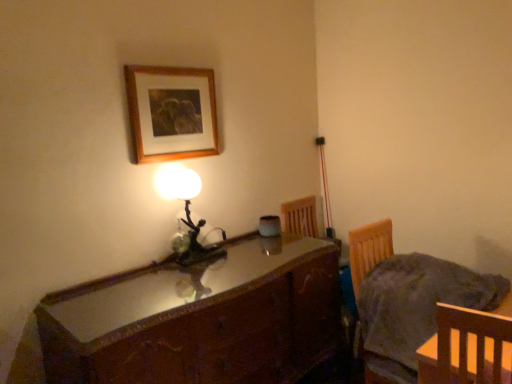
Locate an element on the screen. Image resolution: width=512 pixels, height=384 pixels. wooden picture frame at upper center is located at coordinates click(170, 112).

The image size is (512, 384). I want to click on shiny brown wooden desk at center, so (x=200, y=319).

How distant is matte glass lamp at center from wooden chair at lower right?

They are 32.79 inches apart.

Visually, is matte glass lamp at center positioned to the left or to the right of wooden chair at lower right?

In the image, matte glass lamp at center appears on the left side of wooden chair at lower right.

What's the angular difference between matte glass lamp at center and wooden chair at lower right's facing directions?

7.04 degrees.

From the picture: Is matte glass lamp at center wider or thinner than wooden chair at lower right?

In the image, matte glass lamp at center appears to be more narrow than wooden chair at lower right.

Does wooden chair at lower right come in front of shiny brown wooden desk at center?

No, wooden chair at lower right is behind shiny brown wooden desk at center.

Would you consider wooden chair at lower right to be distant from shiny brown wooden desk at center?

No, wooden chair at lower right is not far from shiny brown wooden desk at center.

Considering the positions of objects wooden chair at lower right and shiny brown wooden desk at center in the image provided, who is more to the left, wooden chair at lower right or shiny brown wooden desk at center?

shiny brown wooden desk at center.

Is wooden chair at lower right taller than shiny brown wooden desk at center?

In fact, wooden chair at lower right may be shorter than shiny brown wooden desk at center.

Choose the correct answer: Is wooden picture frame at upper center inside shiny brown wooden desk at center or outside it?

wooden picture frame at upper center lies outside shiny brown wooden desk at center.

From the image's perspective, is wooden picture frame at upper center on shiny brown wooden desk at center?

Correct, wooden picture frame at upper center appears higher than shiny brown wooden desk at center in the image.

From a real-world perspective, is wooden picture frame at upper center below shiny brown wooden desk at center?

No.

Is wooden picture frame at upper center bigger than shiny brown wooden desk at center?

Actually, wooden picture frame at upper center might be smaller than shiny brown wooden desk at center.

You are a GUI agent. You are given a task and a screenshot of the screen. Output one action in this format:
    pyautogui.click(x=<x>, y=<y>)
    Task: Click on the cabinetry that is on the right side of matte glass lamp at center
    The height and width of the screenshot is (384, 512).
    Given the screenshot: What is the action you would take?
    pyautogui.click(x=200, y=319)

Which object is wider, matte glass lamp at center or shiny brown wooden desk at center?

With larger width is shiny brown wooden desk at center.

Which point is more distant from viewer, (185, 201) or (73, 322)?

The point (185, 201) is more distant.

Who is shorter, matte glass lamp at center or shiny brown wooden desk at center?

matte glass lamp at center.

From the image's perspective, which is above, wooden chair at lower right or wooden picture frame at upper center?

wooden picture frame at upper center.

Is wooden chair at lower right in contact with wooden picture frame at upper center?

No, wooden chair at lower right is not touching wooden picture frame at upper center.

How many degrees apart are the facing directions of wooden chair at lower right and wooden picture frame at upper center?

There is a 9.03-degree angle between the facing directions of wooden chair at lower right and wooden picture frame at upper center.

Considering their positions, is wooden picture frame at upper center located in front of or behind matte glass lamp at center?

wooden picture frame at upper center is in front of matte glass lamp at center.

In the scene shown: Which of these two, wooden picture frame at upper center or matte glass lamp at center, is thinner?

wooden picture frame at upper center.

Which of these two, wooden picture frame at upper center or matte glass lamp at center, is bigger?

Bigger between the two is matte glass lamp at center.

From a real-world perspective, which is physically below, wooden picture frame at upper center or matte glass lamp at center?

matte glass lamp at center, from a real-world perspective.

From a real-world perspective, is wooden picture frame at upper center positioned above or below wooden chair at lower right?

wooden picture frame at upper center is situated higher than wooden chair at lower right in the real world.

From the image's perspective, between wooden picture frame at upper center and wooden chair at lower right, which one is located above?

wooden picture frame at upper center appears higher in the image.

Is wooden picture frame at upper center oriented away from wooden chair at lower right?

No, wooden picture frame at upper center's orientation is not away from wooden chair at lower right.

Is wooden picture frame at upper center situated inside wooden chair at lower right or outside?

wooden picture frame at upper center is not enclosed by wooden chair at lower right.

In order to click on lamp lying above the wooden chair at lower right (from the image's perspective) in this screenshot , I will do `click(186, 210)`.

In the image, there is a wooden chair at lower right. Where is `cabinetry below it (from a real-world perspective)`? The width and height of the screenshot is (512, 384). cabinetry below it (from a real-world perspective) is located at coordinates (200, 319).

When comparing their distances from matte glass lamp at center, does wooden chair at lower right or wooden picture frame at upper center seem closer?

Based on the image, wooden picture frame at upper center appears to be nearer to matte glass lamp at center.

Considering their positions, is wooden picture frame at upper center positioned closer to matte glass lamp at center than wooden chair at lower right?

Among the two, wooden picture frame at upper center is located nearer to matte glass lamp at center.

Considering their positions, is wooden chair at lower right positioned closer to shiny brown wooden desk at center than wooden picture frame at upper center?

Based on the image, wooden chair at lower right appears to be nearer to shiny brown wooden desk at center.

Considering their positions, is shiny brown wooden desk at center positioned further to wooden chair at lower right than matte glass lamp at center?

matte glass lamp at center is further to wooden chair at lower right.

From the picture: Which object lies nearer to the anchor point wooden picture frame at upper center, shiny brown wooden desk at center or matte glass lamp at center?

matte glass lamp at center lies closer to wooden picture frame at upper center than the other object.

Based on their spatial positions, is wooden picture frame at upper center or matte glass lamp at center closer to wooden chair at lower right?

matte glass lamp at center is positioned closer to the anchor wooden chair at lower right.

Looking at the image, which one is located closer to wooden picture frame at upper center, wooden chair at lower right or shiny brown wooden desk at center?

shiny brown wooden desk at center is closer to wooden picture frame at upper center.

Based on their spatial positions, is wooden chair at lower right or shiny brown wooden desk at center further from matte glass lamp at center?

wooden chair at lower right.

Identify the location of cabinetry situated between wooden picture frame at upper center and wooden chair at lower right from left to right. (200, 319).

You are a GUI agent. You are given a task and a screenshot of the screen. Output one action in this format:
    pyautogui.click(x=<x>, y=<y>)
    Task: Click on the cabinetry between matte glass lamp at center and wooden chair at lower right
    
    Given the screenshot: What is the action you would take?
    pyautogui.click(x=200, y=319)

Identify the location of lamp between wooden picture frame at upper center and wooden chair at lower right. (186, 210).

Where is `lamp between wooden picture frame at upper center and shiny brown wooden desk at center in the up-down direction`? Image resolution: width=512 pixels, height=384 pixels. lamp between wooden picture frame at upper center and shiny brown wooden desk at center in the up-down direction is located at coordinates (186, 210).